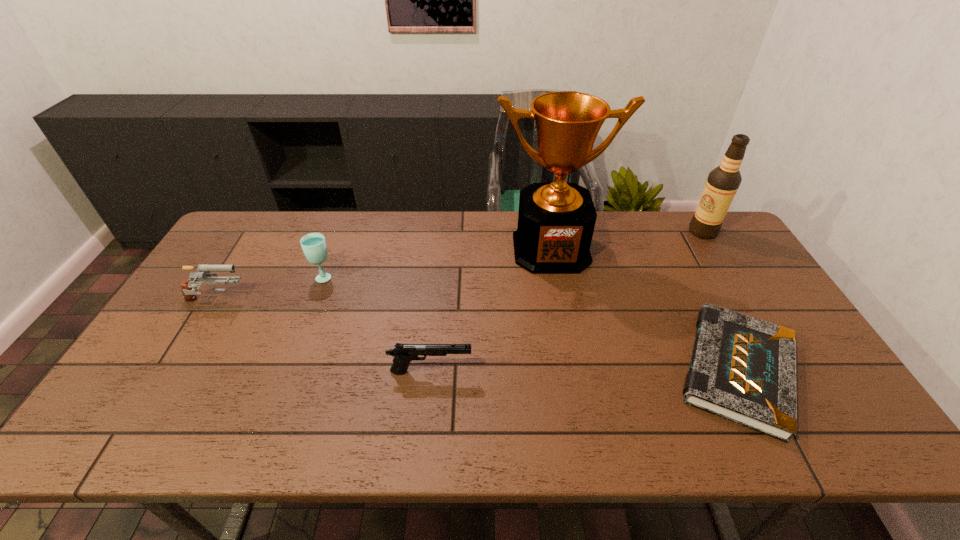
Image resolution: width=960 pixels, height=540 pixels. Find the location of `trophy cup`. trophy cup is located at coordinates (556, 221).

You are a GUI agent. You are given a task and a screenshot of the screen. Output one action in this format:
    pyautogui.click(x=<x>, y=<y>)
    Task: Click on the tallest object
    
    Given the screenshot: What is the action you would take?
    pyautogui.click(x=556, y=221)

At what (x,y) coordinates should I click in order to perform the action: click on the second tallest object. Please return your answer as a coordinate pair (x, y). Looking at the image, I should click on (723, 182).

This screenshot has width=960, height=540. What are the coordinates of `glass` in the screenshot? It's located at (314, 247).

Image resolution: width=960 pixels, height=540 pixels. In order to click on the leftmost object in this screenshot , I will do `click(189, 291)`.

Where is `the taller gun`? the taller gun is located at coordinates (189, 291).

The image size is (960, 540). I want to click on the fourth object from right to left, so click(x=403, y=354).

Find the location of a particular element. The image size is (960, 540). the shorter gun is located at coordinates (403, 354).

Find the location of `notebook`. notebook is located at coordinates (743, 369).

This screenshot has width=960, height=540. In order to click on vacant region located on the front of the tallest object with the label in this screenshot , I will do `click(563, 315)`.